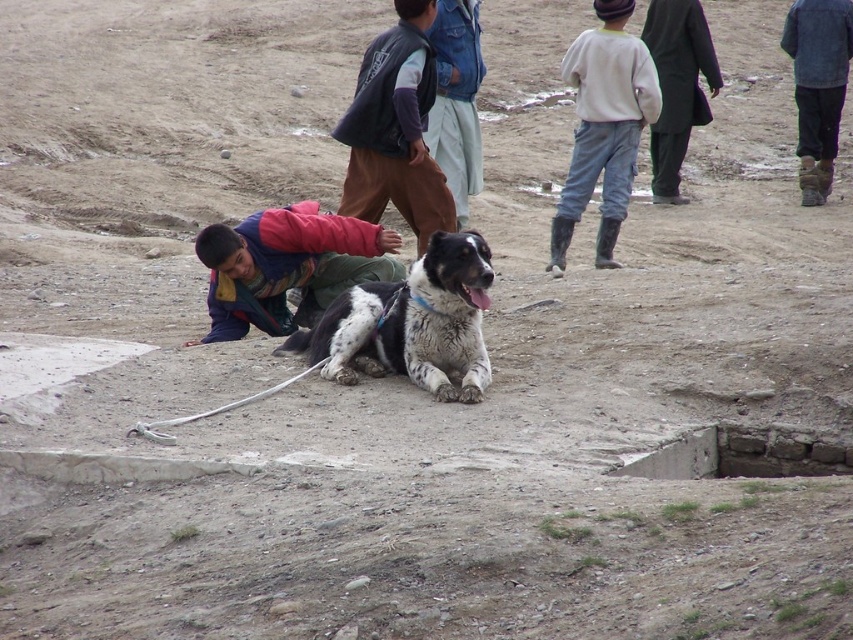
Question: Which object is farther from the camera taking this photo?

Choices:
 (A) multicolored fleece jacket at lower left
 (B) light gray cotton pants at upper center

Answer: (B)

Question: Can you confirm if dark brown fabric vest at center is wider than light gray cotton pants at upper center?

Choices:
 (A) yes
 (B) no

Answer: (B)

Question: Can you confirm if dark brown fabric vest at center is positioned to the left of light gray cotton pants at upper center?

Choices:
 (A) no
 (B) yes

Answer: (B)

Question: Which of the following is the closest to the observer?

Choices:
 (A) (270, 260)
 (B) (619, 116)
 (C) (422, 284)
 (D) (405, 16)

Answer: (C)

Question: Does dark brown fabric vest at center appear under light gray cotton pants at upper center?

Choices:
 (A) no
 (B) yes

Answer: (A)

Question: Which object is closer to the camera taking this photo?

Choices:
 (A) light gray cotton pants at upper center
 (B) spotted fur dog at center
 (C) dark brown fabric vest at center
 (D) multicolored fleece jacket at lower left

Answer: (B)